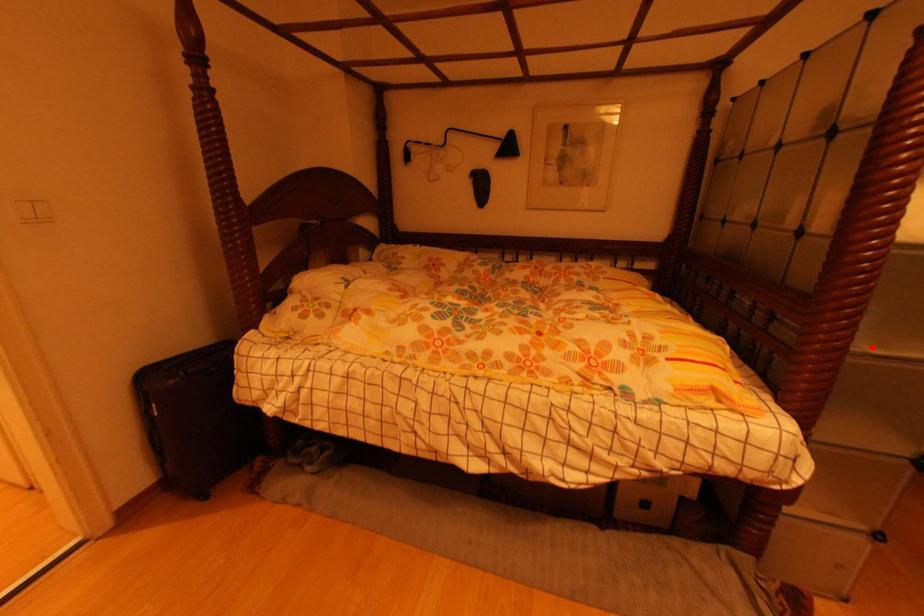
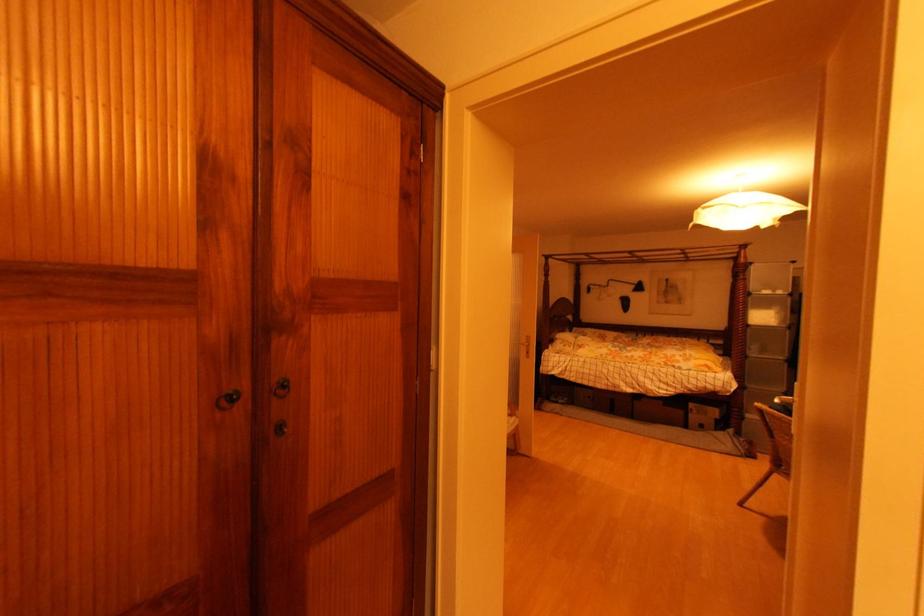
Locate, in the second image, the point that corresponds to the highlighted location in the first image.

(759, 355)